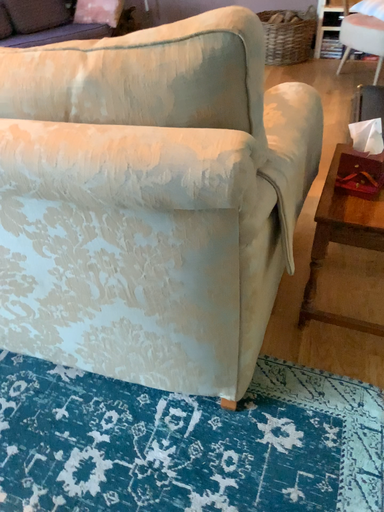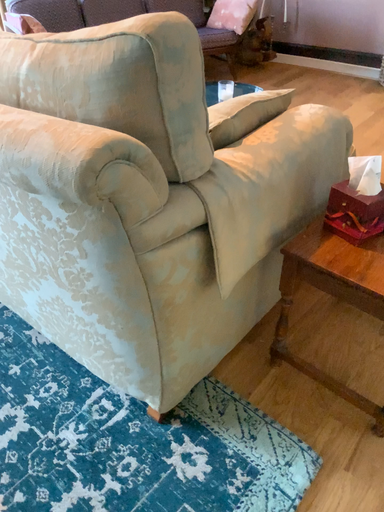
Question: How did the camera likely rotate when shooting the video?

Choices:
 (A) rotated right
 (B) rotated left

Answer: (B)